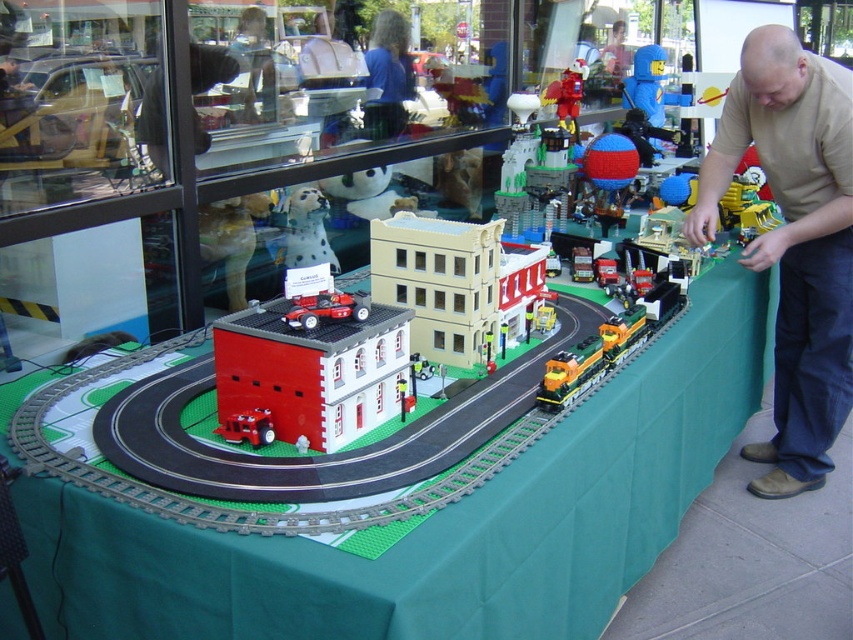
Question: Can you confirm if green fabric tablecloth at center is thinner than white matte building at center?

Choices:
 (A) yes
 (B) no

Answer: (B)

Question: Among these points, which one is nearest to the camera?

Choices:
 (A) tap(630, 342)
 (B) tap(267, 353)
 (C) tap(264, 433)
 (D) tap(306, 253)

Answer: (B)

Question: Does green fabric tablecloth at center have a larger size compared to white matte building at center?

Choices:
 (A) yes
 (B) no

Answer: (A)

Question: In this image, where is white matte building at center located relative to white matte dog at upper center?

Choices:
 (A) above
 (B) below

Answer: (B)

Question: Which of the following is the closest to the observer?

Choices:
 (A) (721, 285)
 (B) (643, 330)

Answer: (B)

Question: Which of the following is the closest to the observer?

Choices:
 (A) white matte building at center
 (B) brick red fire station at center

Answer: (B)